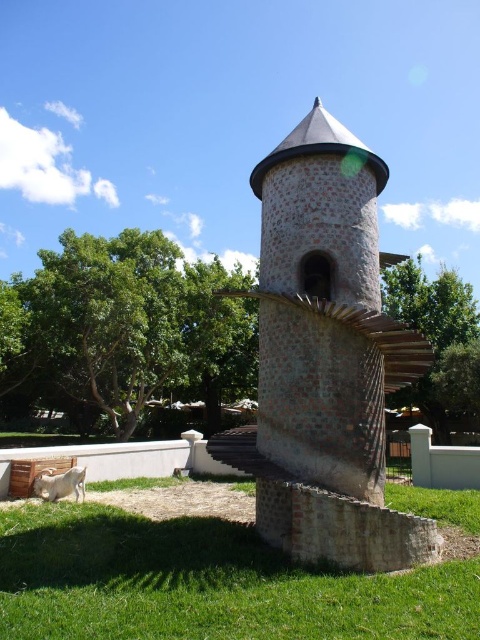
Question: Estimate the real-world distances between objects in this image. Which object is closer to the green leafy tree at upper left?

Choices:
 (A) green grass at lower center
 (B) green leafy tree at upper right

Answer: (B)

Question: Is brown stone water tower at center smaller than white woolen goat at lower left?

Choices:
 (A) no
 (B) yes

Answer: (A)

Question: Is green leafy tree at upper right above white woolen goat at lower left?

Choices:
 (A) no
 (B) yes

Answer: (B)

Question: Where is green leafy tree at upper left located in relation to white woolen goat at lower left in the image?

Choices:
 (A) below
 (B) above

Answer: (B)

Question: Which point is closer to the camera taking this photo?

Choices:
 (A) (433, 298)
 (B) (310, 172)
 (C) (84, 381)

Answer: (B)

Question: Which is nearer to the white woolen goat at lower left?

Choices:
 (A) green grass at lower center
 (B) brown stone water tower at center
 (C) green leafy tree at upper right

Answer: (A)